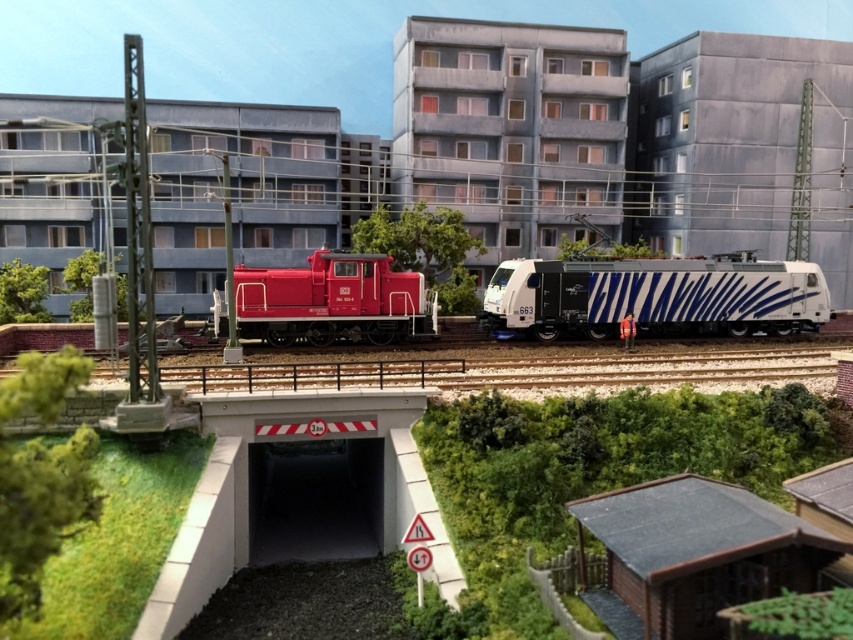
You are a model railway enthusiast who wants to place both the white glossy locomotive at center and the matte red locomotive at center on the same track. Based on their widths, which locomotive might require a wider track to accommodate it?

The white glossy locomotive at center might require a wider track because it is wider than the matte red locomotive at center according to the description.

Based on the photo, you are a model train enthusiast who wants to place a new train car between the white glossy locomotive at center and the matte red locomotive at center. The new train car is 10 meters long. Is there enough space between the two locomotives to accommodate it?

The white glossy locomotive at center is 15.09 meters away from the matte red locomotive at center. Since the new train car is 10 meters long, there is enough space between them to place it.

You are a model train enthusiast who wants to place a new train car between the white glossy locomotive at center and the matte red locomotive at center. Based on their positions, which locomotive should the new train car be placed closer to?

The new train car should be placed closer to the matte red locomotive at center because the white glossy locomotive at center is positioned on the right side of it, meaning there is more space between them on the left side.